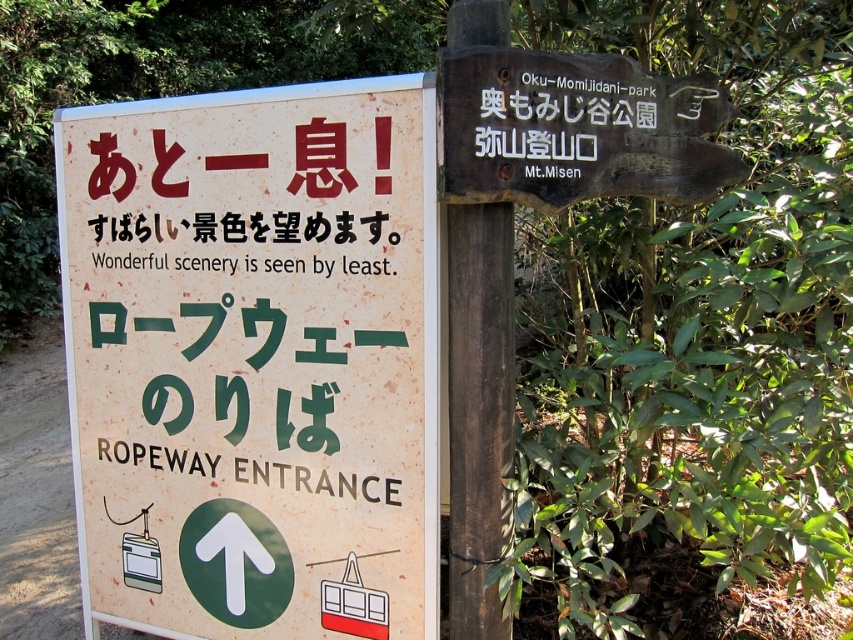
Who is shorter, beige paper sign at left or blackmaterial/texturetext at upper center?

blackmaterial/texturetext at upper center is shorter.

Is beige paper sign at left wider than blackmaterial/texturetext at upper center?

Correct, the width of beige paper sign at left exceeds that of blackmaterial/texturetext at upper center.

Where is `beige paper sign at left`? This screenshot has height=640, width=853. beige paper sign at left is located at coordinates (254, 358).

At what (x,y) coordinates should I click in order to perform the action: click on beige paper sign at left. Please return your answer as a coordinate pair (x, y). Looking at the image, I should click on (254, 358).

Looking at this image, is beige paper sign at left shorter than brown wooden signpost at upper center?

No.

Is beige paper sign at left above brown wooden signpost at upper center?

Incorrect, beige paper sign at left is not positioned above brown wooden signpost at upper center.

Which is behind, point (161, 161) or point (456, 608)?

The point (161, 161) is behind.

Locate an element on the screen. The height and width of the screenshot is (640, 853). beige paper sign at left is located at coordinates (254, 358).

You are a GUI agent. You are given a task and a screenshot of the screen. Output one action in this format:
    pyautogui.click(x=<x>, y=<y>)
    Task: Click on the brown wooden signpost at upper right
    
    Given the screenshot: What is the action you would take?
    pyautogui.click(x=575, y=129)

Which is more to the left, brown wooden signpost at upper right or brown wooden signpost at upper center?

Positioned to the left is brown wooden signpost at upper center.

Does point (605, 52) come closer to viewer compared to point (503, 451)?

No.

Identify the location of brown wooden signpost at upper right. (575, 129).